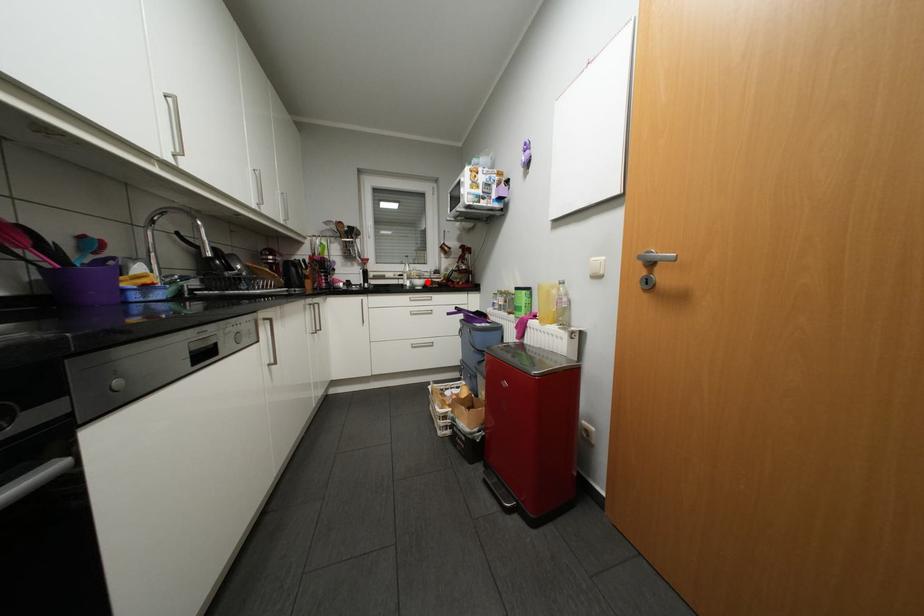
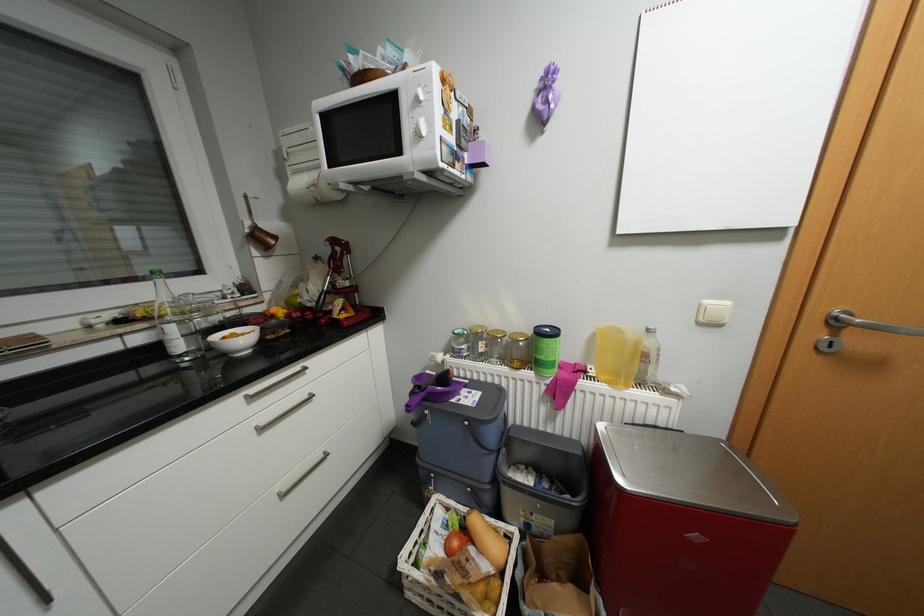
Find the pixel in the second image that matches the highlighted location in the first image.

(249, 339)